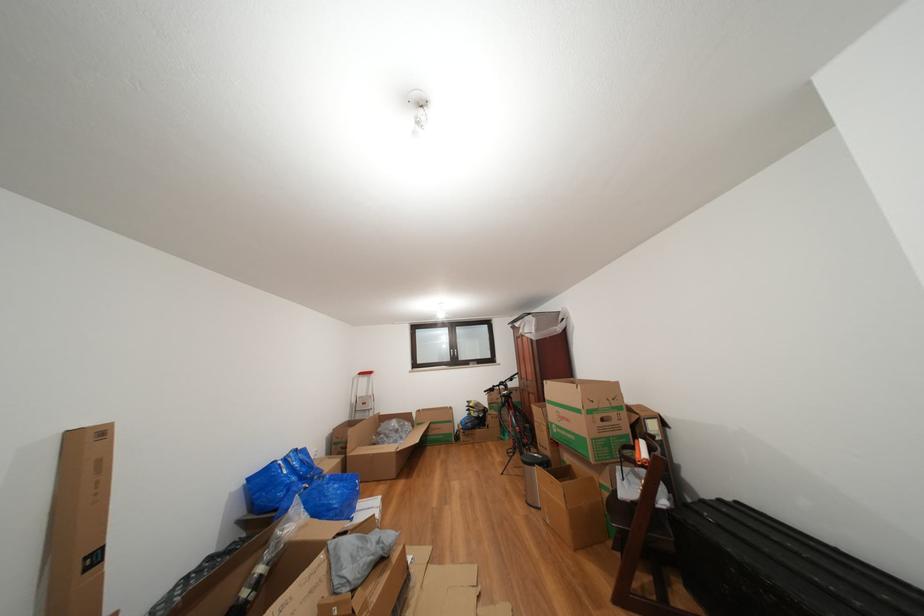
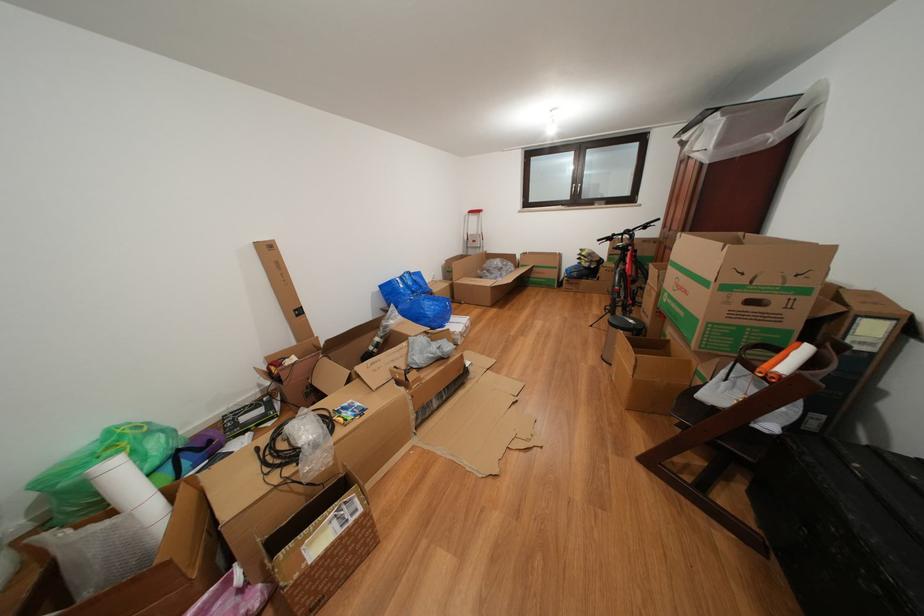
The point at (294, 477) is marked in the first image. Where is the corresponding point in the second image?

(409, 291)